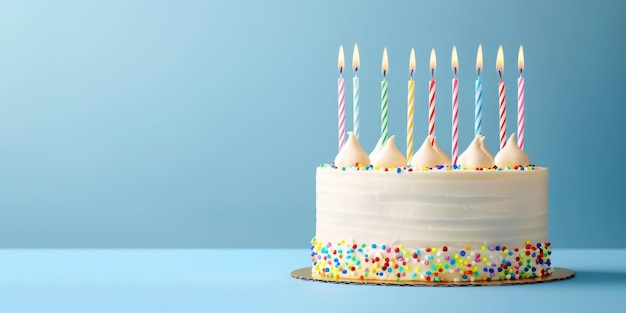
This screenshot has height=313, width=626. Identify the location of birthday candle wicks. (412, 72), (384, 71), (355, 69), (342, 68), (431, 70), (454, 70), (478, 69), (500, 74), (521, 69).